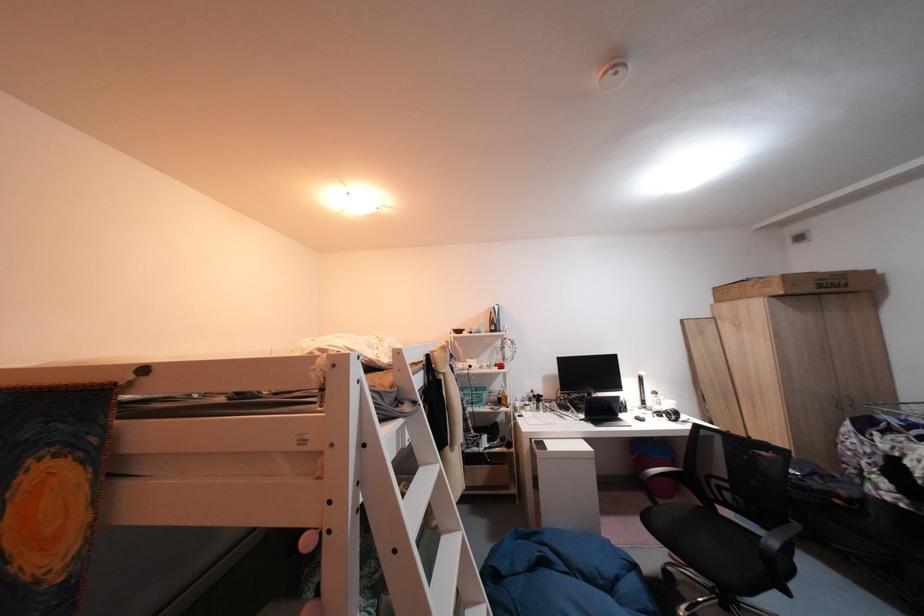
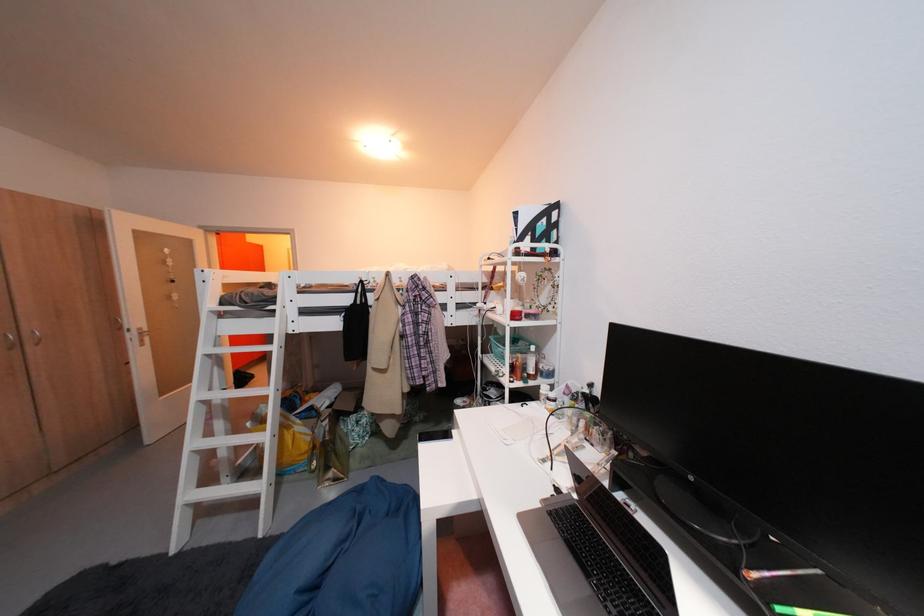
Where in the second image is the point corresponding to point 488,407 from the first image?

(514, 363)